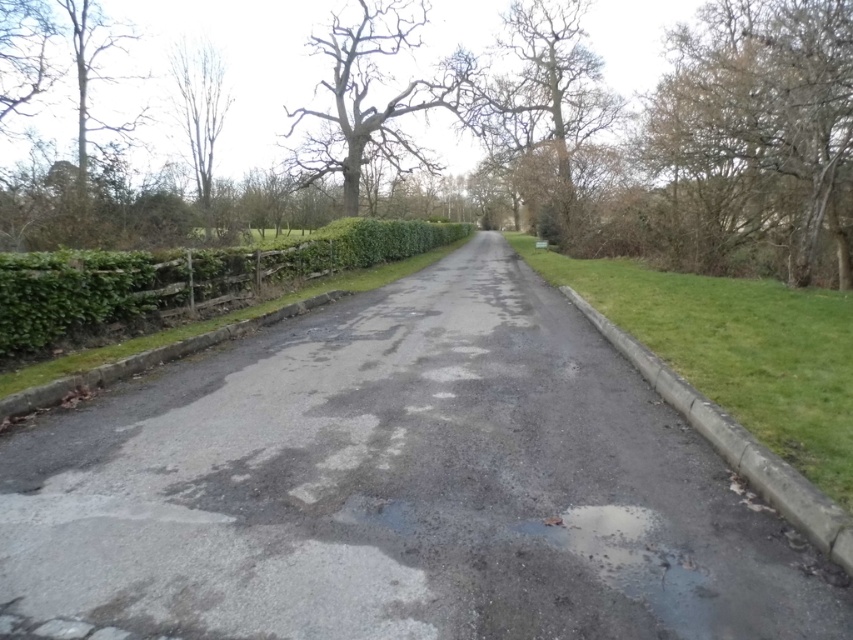
You are standing at the center of the rural road and want to step onto the green grass at right. Which direction should you move to reach it?

The green grass at right is located at point [737,349], so you should move to your right side to reach it.

You are driving a delivery van that is 2.5 meters wide. You need to turn left onto a side road that is narrower than the current road. The side road is bordered by the porous asphalt driveway at center and the green leafy hedge at left. Can your van safely navigate the turn without hitting either the driveway or the hedge?

The porous asphalt driveway at center is positioned on the right side of the green leafy hedge at left. Since the driveway is to the right of the hedge, the turn would require navigating around both obstacles. However, the description does not provide specific measurements of the turning space between them. Without knowing the exact width of the turn area, it is impossible to determine if the 2.5 meter wide van can safely maneuver without hitting either the driveway or the hedge.

You are a painter standing at the edge of the road and want to paint the scene. Which object, the bare wood tree at upper right or the green grass at right, would you need to make wider in your painting to match the actual view?

The bare wood tree at upper right has a lesser width compared to green grass at right, so you should make the bare wood tree at upper right wider in your painting to match the actual view.